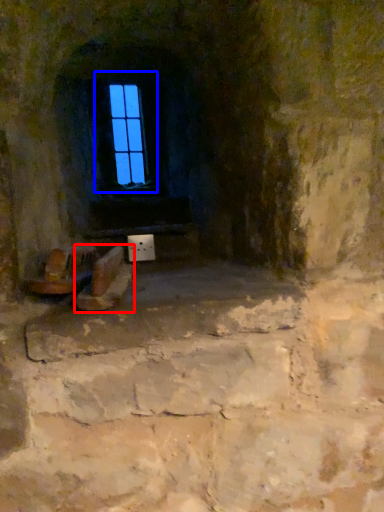
Question: Among these objects, which one is nearest to the camera, footwear (highlighted by a red box) or window (highlighted by a blue box)?

Choices:
 (A) footwear
 (B) window

Answer: (A)